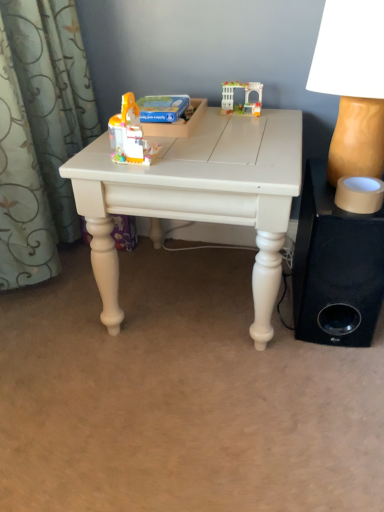
Identify the location of vacant space situated above white matte table at center (from a real-world perspective). (187, 136).